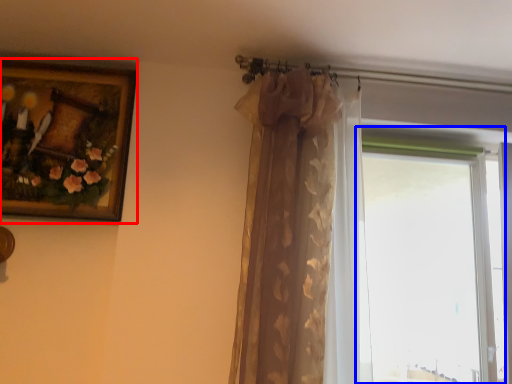
Question: Which object is further to the camera taking this photo, picture frame (highlighted by a red box) or window (highlighted by a blue box)?

Choices:
 (A) picture frame
 (B) window

Answer: (B)